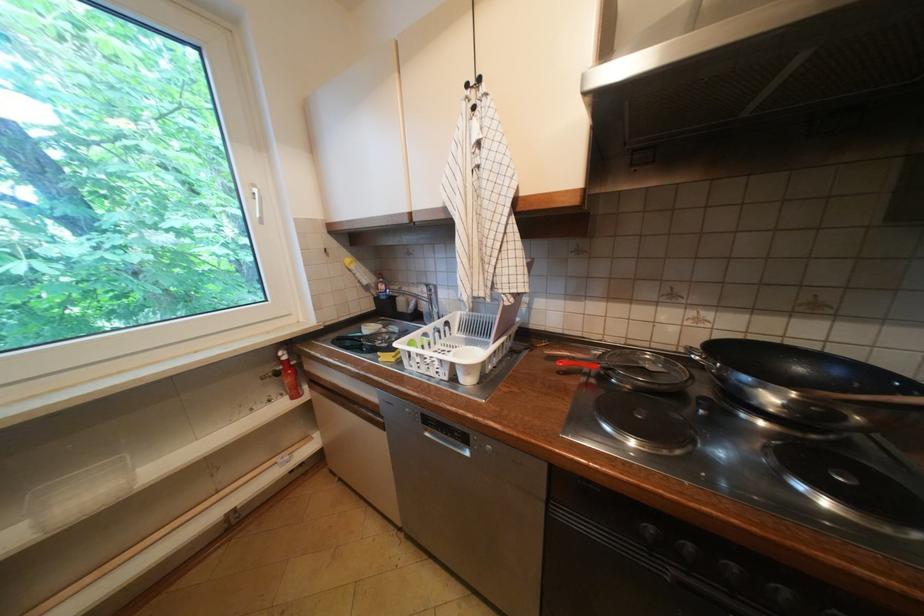
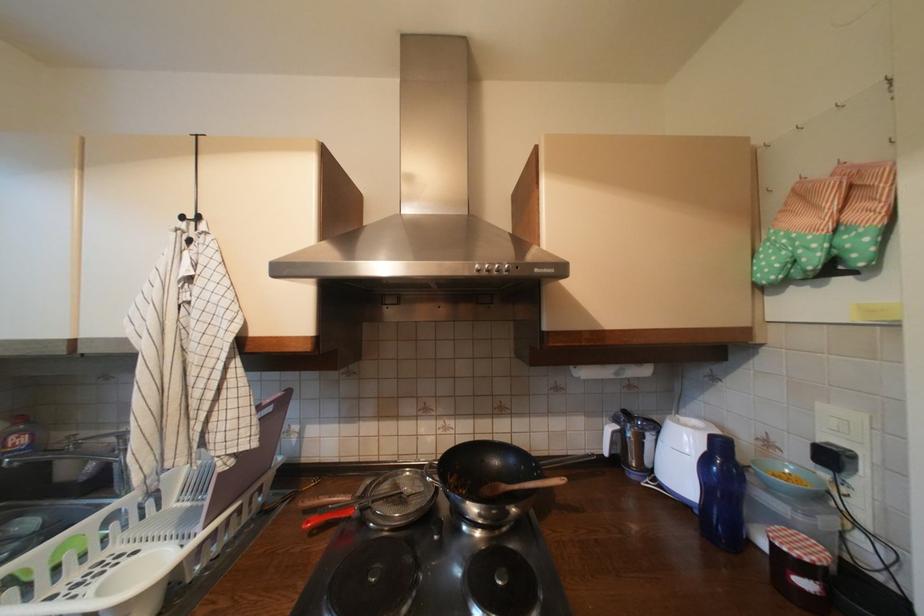
Find the pixel in the second image that matches (651,369) in the first image.

(410, 495)